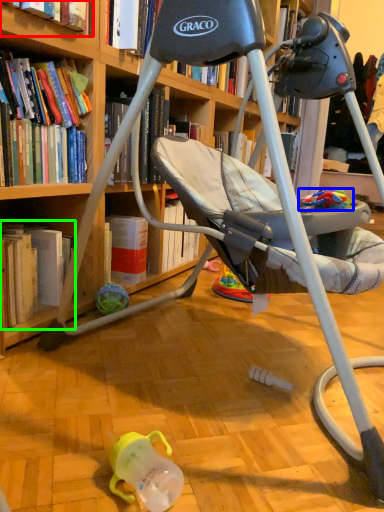
Question: Which object is positioned farthest from book (highlighted by a red box)? Select from toy (highlighted by a blue box) and book (highlighted by a green box).

Choices:
 (A) toy
 (B) book

Answer: (A)